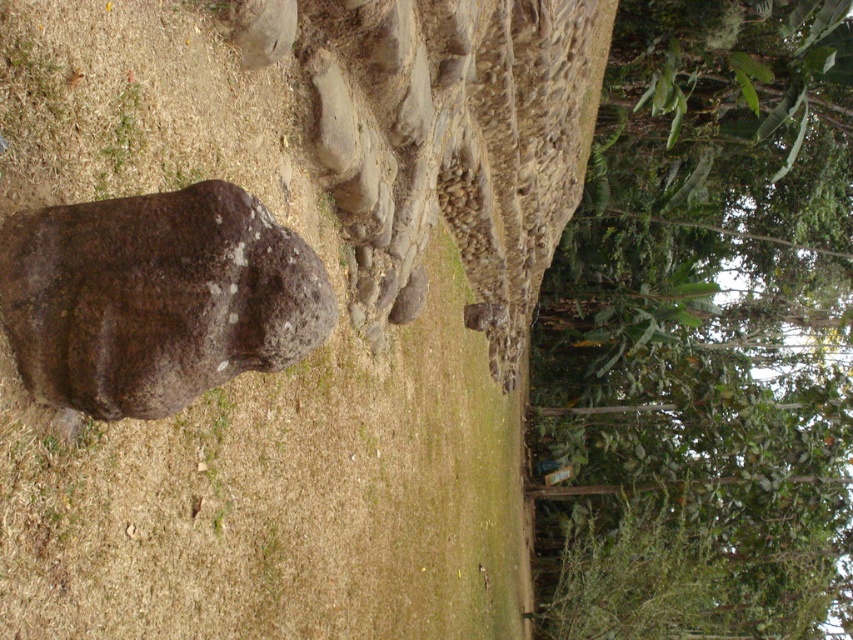
Question: Is green leafy tree at upper right positioned before brown rough stone at center?

Choices:
 (A) yes
 (B) no

Answer: (B)

Question: Which object appears closest to the camera in this image?

Choices:
 (A) green leafy tree at upper right
 (B) brown rough stone at center

Answer: (B)

Question: Can you confirm if green leafy tree at upper right is thinner than brown rough stone at center?

Choices:
 (A) yes
 (B) no

Answer: (B)

Question: Which object is closer to the camera taking this photo?

Choices:
 (A) brown rough stone at center
 (B) green leafy tree at upper right

Answer: (A)

Question: Is green leafy tree at upper right to the right of brown rough stone at center from the viewer's perspective?

Choices:
 (A) yes
 (B) no

Answer: (A)

Question: Which point appears farthest from the camera in this image?

Choices:
 (A) (170, 308)
 (B) (550, 289)

Answer: (B)